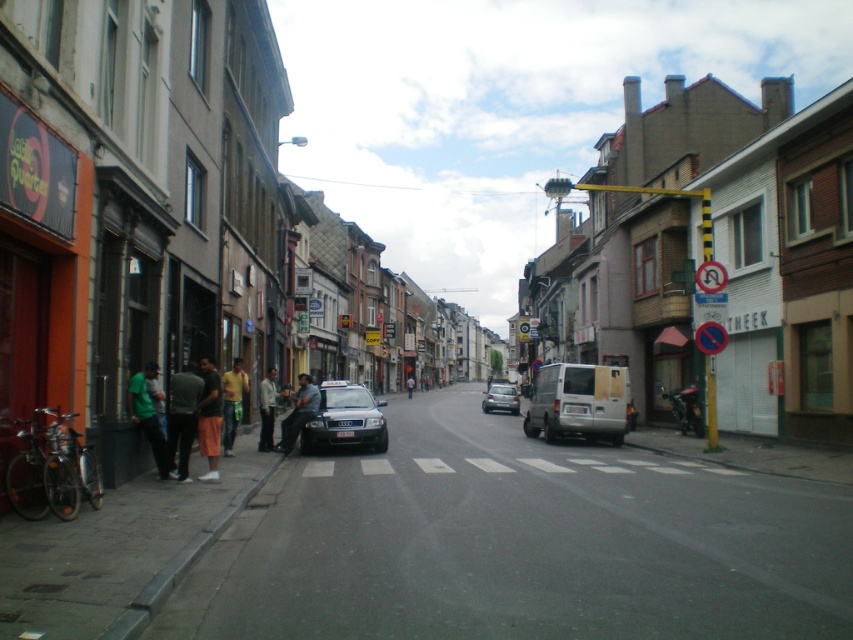
You are a photographer standing on the sidewalk and want to capture both the dark gray fabric pants at left and the silver metallic car at center in your photo. Which object will appear larger in the photo?

The dark gray fabric pants at left will appear larger in the photo because it is closer to the viewer than the silver metallic car at center.